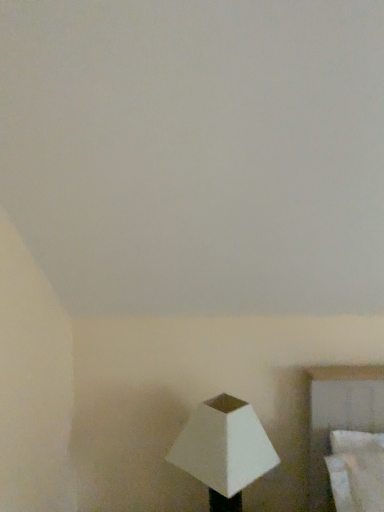
What do you see at coordinates (224, 450) in the screenshot? The image size is (384, 512). I see `white matte lampshade at lower center` at bounding box center [224, 450].

Locate an element on the screen. Image resolution: width=384 pixels, height=512 pixels. white matte lampshade at lower center is located at coordinates (224, 450).

What is the approximate width of white matte lampshade at lower center?

The width of white matte lampshade at lower center is 29.09 centimeters.

Where is `white matte lampshade at lower center`? white matte lampshade at lower center is located at coordinates (224, 450).